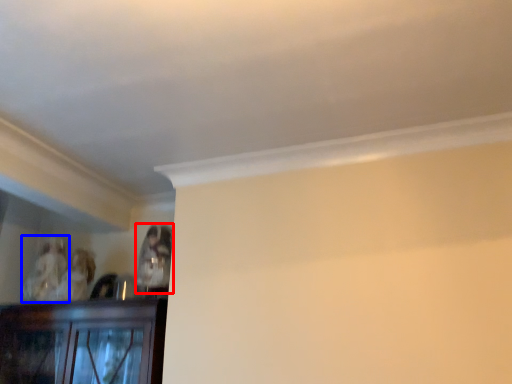
Question: Which of the following is the farthest to the observer, person (highlighted by a red box) or person (highlighted by a blue box)?

Choices:
 (A) person
 (B) person

Answer: (B)